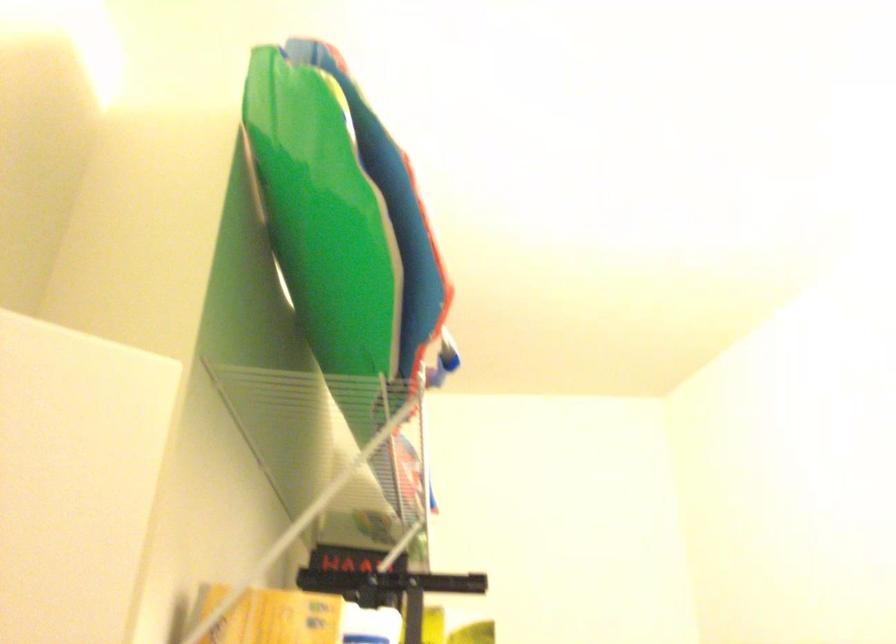
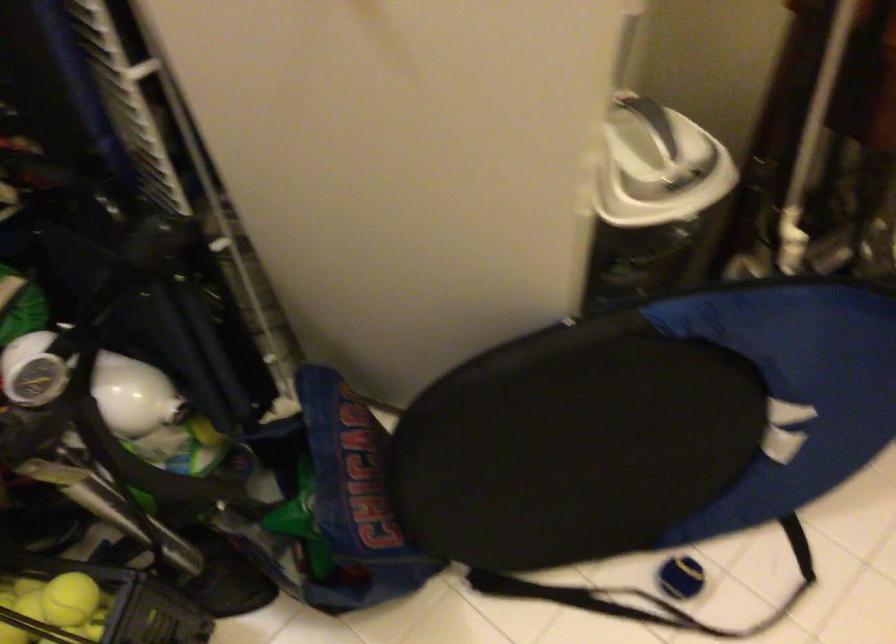
How did the camera likely rotate?

The camera rotated toward left-down.